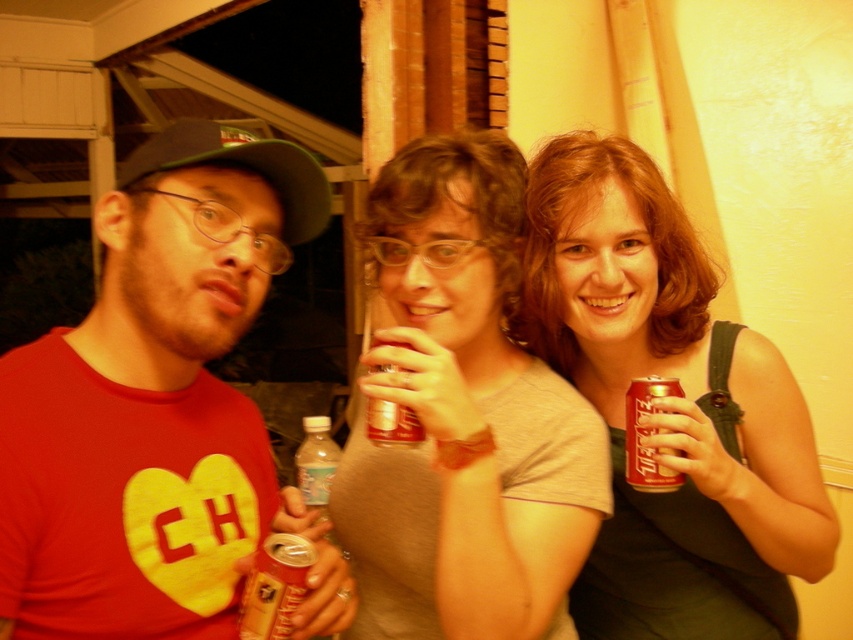
You are at a party and see two cans in the middle of the table. The shiny red can at center and the metallic gold can at center. Which one is more to the right?

The shiny red can at center is more to the right because it is positioned on the right side of the metallic gold can at center.